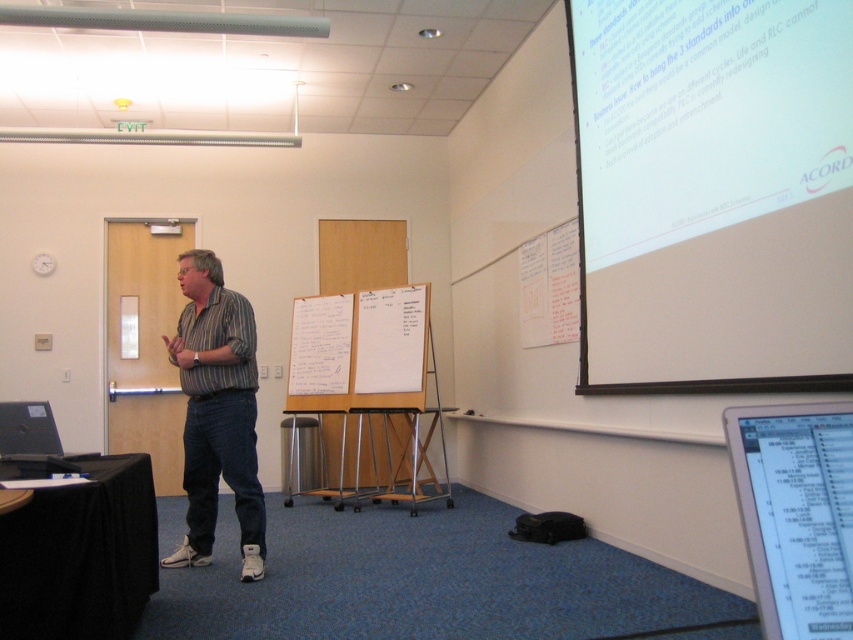
Question: Which is nearer to the white paperboard at center?

Choices:
 (A) white matte projection screen at upper right
 (B) black glossy screen at lower right
 (C) striped cotton shirt at center

Answer: (C)

Question: Which point is farther to the camera?

Choices:
 (A) white matte projection screen at upper right
 (B) black glossy screen at lower right
 (C) striped cotton shirt at center
 (D) white paperboard at center

Answer: (D)

Question: Based on their relative distances, which object is farther from the black glossy screen at lower right?

Choices:
 (A) white paperboard at center
 (B) striped cotton shirt at center

Answer: (A)

Question: Is white matte projection screen at upper right thinner than black glossy screen at lower right?

Choices:
 (A) yes
 (B) no

Answer: (B)

Question: Does white matte projection screen at upper right appear on the left side of black glossy screen at lower right?

Choices:
 (A) no
 (B) yes

Answer: (A)

Question: Does black glossy screen at lower right have a lesser width compared to white paperboard at center?

Choices:
 (A) yes
 (B) no

Answer: (A)